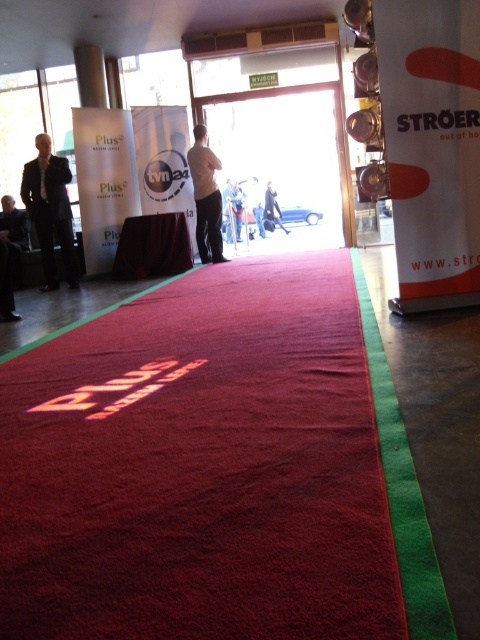
Can you confirm if matte black suit at left is thinner than light beige fabric pants at center?

In fact, matte black suit at left might be wider than light beige fabric pants at center.

Is point (61, 177) farther from camera compared to point (206, 205)?

No, it is in front of (206, 205).

You are a GUI agent. You are given a task and a screenshot of the screen. Output one action in this format:
    pyautogui.click(x=<x>, y=<y>)
    Task: Click on the matte black suit at left
    
    Given the screenshot: What is the action you would take?
    pyautogui.click(x=49, y=211)

At what (x,y) coordinates should I click in order to perform the action: click on matte black suit at left. Please return your answer as a coordinate pair (x, y). This screenshot has height=640, width=480. Looking at the image, I should click on (49, 211).

In the scene shown: How far apart are matte black suit at left and dark gray suit at left?

The distance of matte black suit at left from dark gray suit at left is 3.74 feet.

Is matte black suit at left shorter than dark gray suit at left?

In fact, matte black suit at left may be taller than dark gray suit at left.

Describe the element at coordinates (49, 211) in the screenshot. The height and width of the screenshot is (640, 480). I see `matte black suit at left` at that location.

You are a GUI agent. You are given a task and a screenshot of the screen. Output one action in this format:
    pyautogui.click(x=<x>, y=<y>)
    Task: Click on the matte black suit at left
    The width and height of the screenshot is (480, 640).
    Given the screenshot: What is the action you would take?
    pyautogui.click(x=49, y=211)

Is red carpet at center taller than dark gray suit at left?

No.

Is red carpet at center to the right of dark gray suit at left from the viewer's perspective?

Correct, you'll find red carpet at center to the right of dark gray suit at left.

I want to click on red carpet at center, so click(216, 474).

Where is `red carpet at center`? red carpet at center is located at coordinates (216, 474).